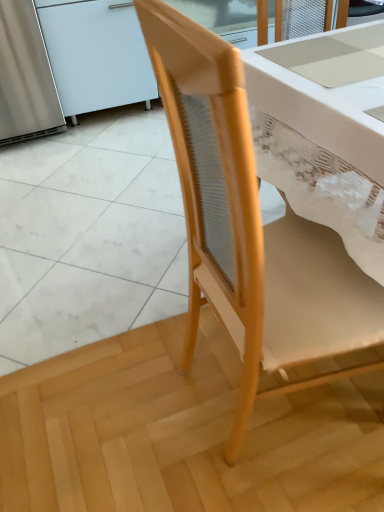
Identify the location of natural wood chair at center. (248, 223).

Measure the distance between point [153,12] and camera.

The distance of point [153,12] from camera is 58.20 centimeters.

What do you see at coordinates (248, 223) in the screenshot?
I see `natural wood chair at center` at bounding box center [248, 223].

At what (x,y) coordinates should I click in order to perform the action: click on natural wood chair at center. Please return your answer as a coordinate pair (x, y). Looking at the image, I should click on (248, 223).